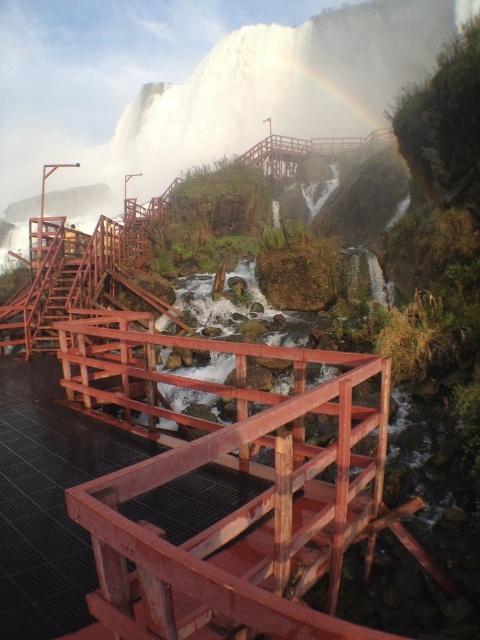
Which of these two, matte red wooden rail at center or wooden bridge at center, stands taller?

wooden bridge at center is taller.

The image size is (480, 640). Describe the element at coordinates (227, 465) in the screenshot. I see `matte red wooden rail at center` at that location.

The width and height of the screenshot is (480, 640). Find the location of `matte red wooden rail at center`. matte red wooden rail at center is located at coordinates (227, 465).